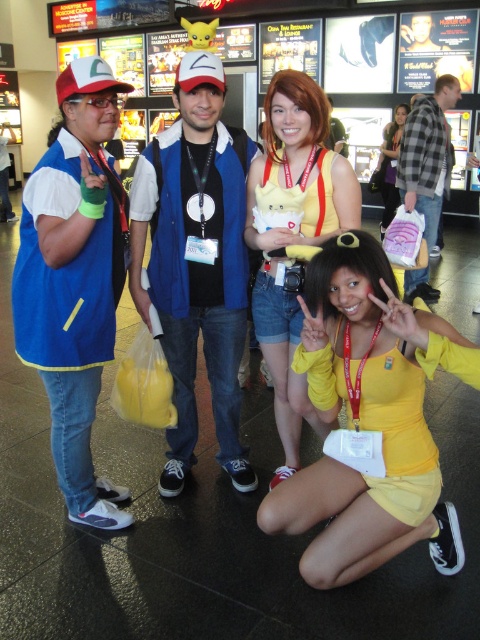
You are a photographer at the event and need to arrange two yellow fabric dresses in the scene for a photo. The dresses are labeled as the yellow fabric dress at center and the yellow fabric dress at lower center. Which dress should you move closer to the camera to make it appear larger in the photo?

To make the yellow fabric dress at center appear larger in the photo, you should move it closer to the camera since it is smaller than the yellow fabric dress at lower center. This adjustment will help balance their sizes in the composition.

You are at an event and want to take a photo with the two central items in the scene. The matte blue vest at center and the yellow fabric dress at center. Which one should you stand to the right of to be in the same frame?

You should stand to the right of the yellow fabric dress at center because the matte blue vest at center is located to the left of it, so positioning yourself there would include both items in the frame.